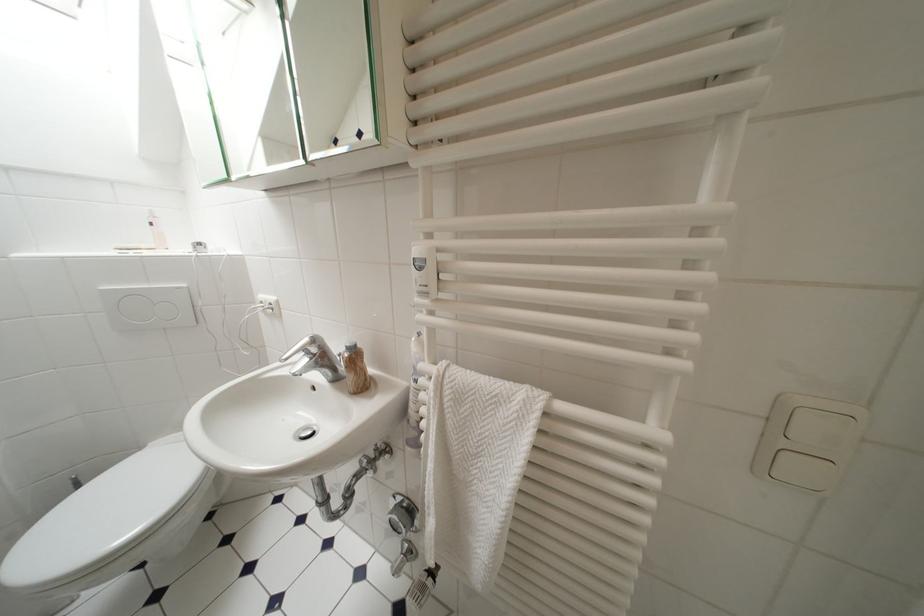
Where would you turn the radiator thermostat? Please return your answer as a coordinate pair (x, y).

(808, 440)